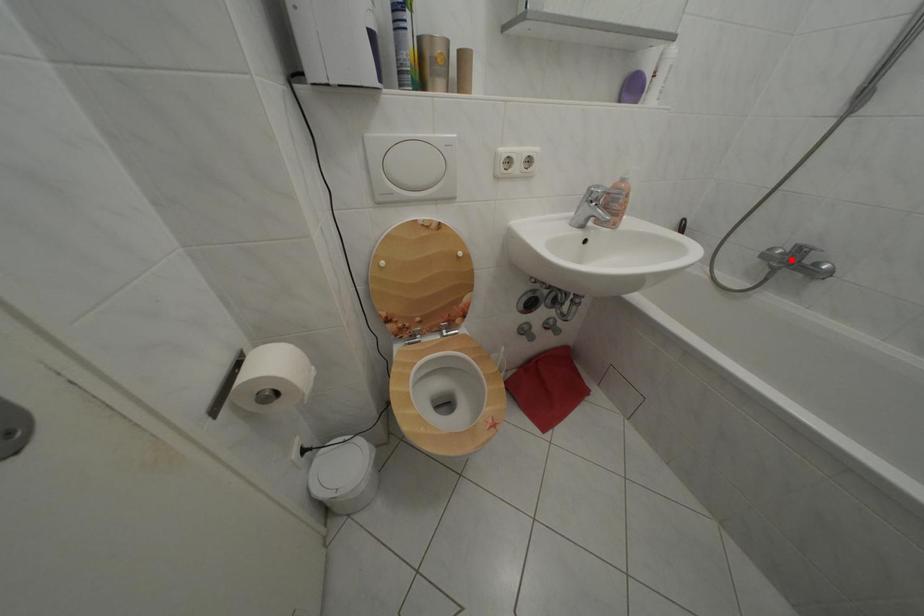
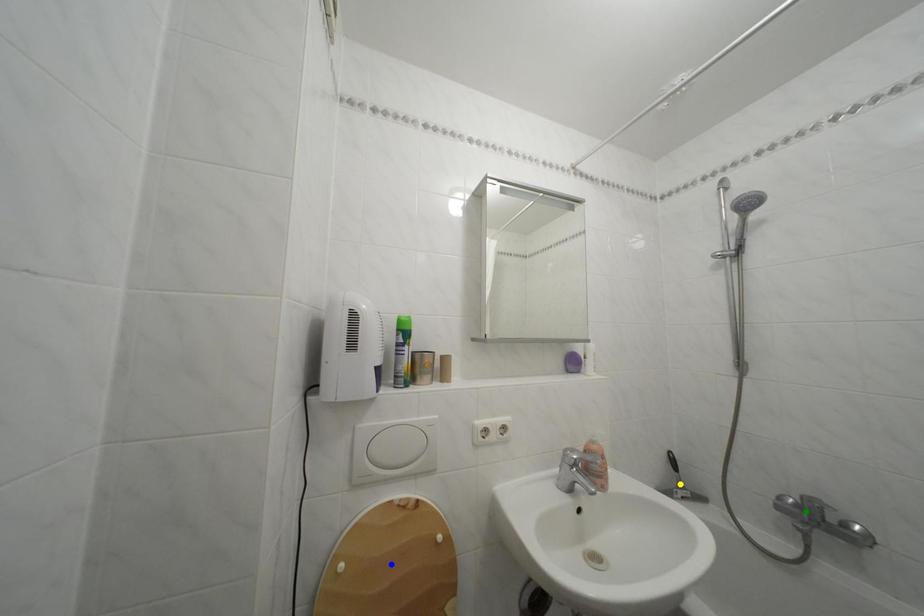
Question: I am providing you with two images of the same scene from different viewpoints. A red point is marked on the first image. You are given multiple points on the second image. Can you choose the point in image 2 that corresponds to the point in image 1?

Choices:
 (A) blue point
 (B) green point
 (C) yellow point

Answer: (B)